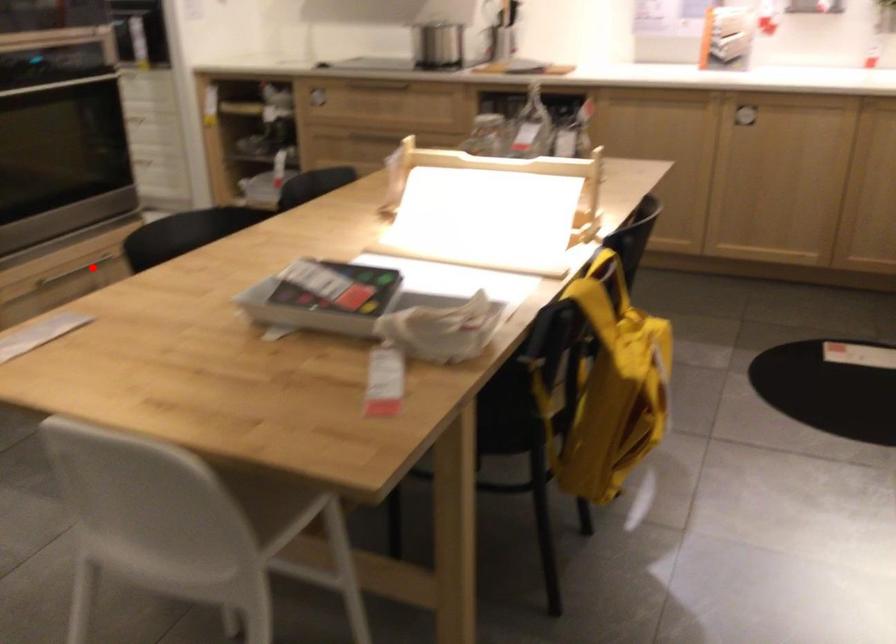
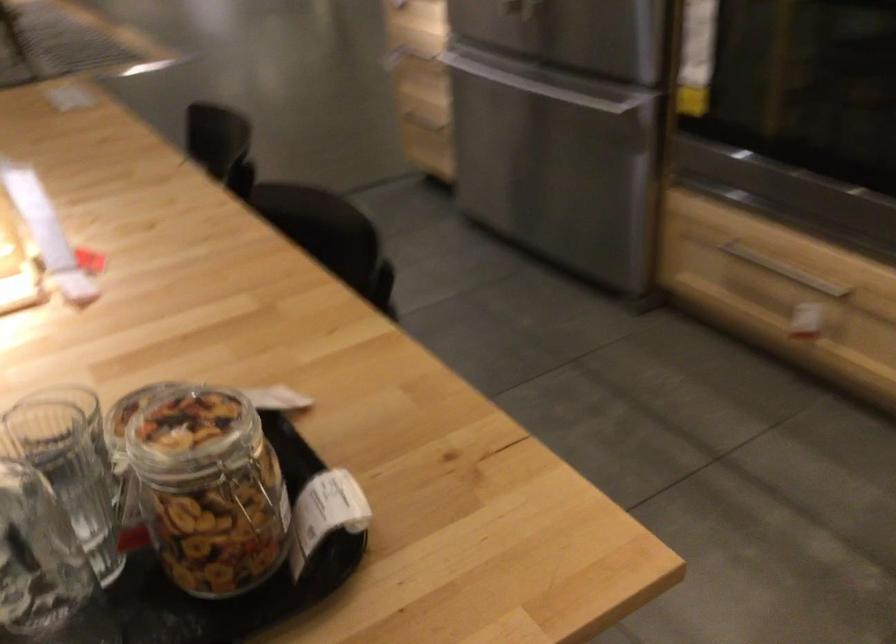
Question: I am providing you with two images of the same scene from different viewpoints. A red point is marked on the first image. Is the red point's position out of view in image 2?

Choices:
 (A) Yes
 (B) No

Answer: (B)